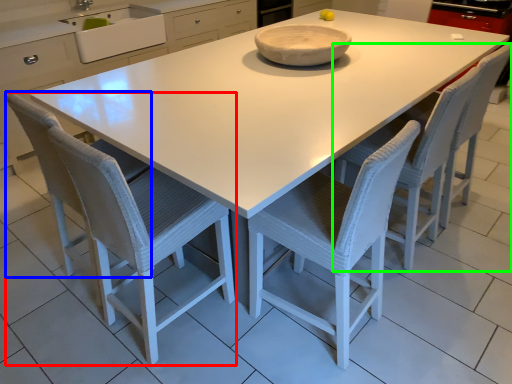
Question: Considering the real-world distances, which object is farthest from chair (highlighted by a red box)? swivel chair (highlighted by a blue box) or chair (highlighted by a green box)?

Choices:
 (A) swivel chair
 (B) chair

Answer: (B)